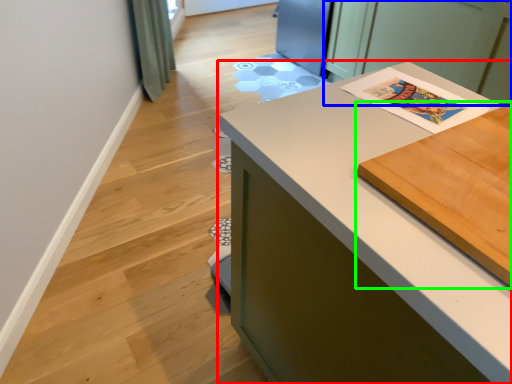
Question: Which object is the closest to the countertop (highlighted by a red box)? Choose among these: cabinetry (highlighted by a blue box) or table (highlighted by a green box).

Choices:
 (A) cabinetry
 (B) table

Answer: (B)